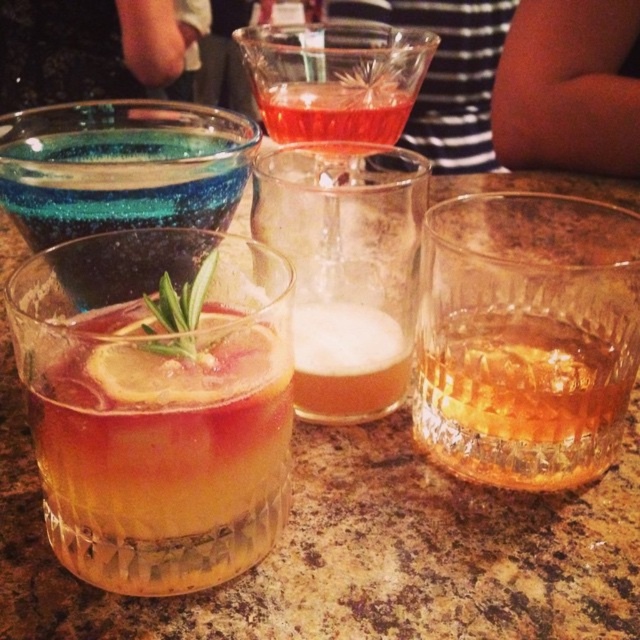
You are a photographer trying to capture the drinks arrangement. You need to focus on the two points labeled as point (483, 308) and point (401, 396). Which point should you focus on first to ensure the foreground glass is sharp?

Point (483, 308) is closer to the camera than point (401, 396), so focusing on point (483, 308) first will ensure the foreground glass is sharp.

You are a bartender preparing a drink and notice the foamy amber liquid at center and the translucent glass at upper center. Which one takes up more space in the image?

The translucent glass at upper center takes up more space than the foamy amber liquid at center.

You are a bartender arranging drinks on a countertop. You have a translucent glass at upper center and a green leafy rosemary at center. According to the arrangement, which object is positioned higher relative to the other?

The translucent glass at upper center is positioned higher than the green leafy rosemary at center.